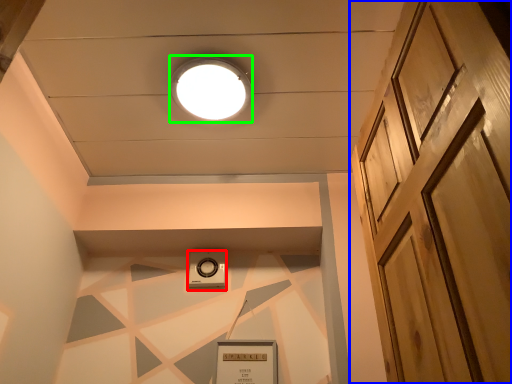
Question: Which object is the closest to the thermostat (highlighted by a red box)? Choose among these: door (highlighted by a blue box) or droplight (highlighted by a green box).

Choices:
 (A) door
 (B) droplight

Answer: (B)